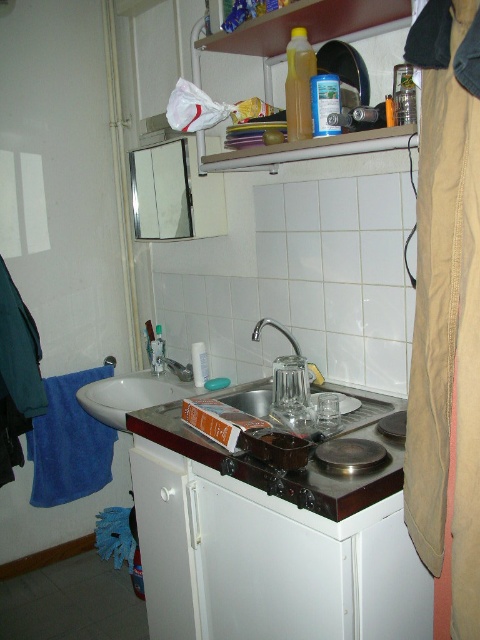
You are trying to place a 12 inch long pan between the black glass stove at center and the silver metallic faucet at center. Will it fit?

The black glass stove at center and silver metallic faucet at center are 13.42 inches apart. Since the pan is 12 inches long, it will fit between them with about 1.42 inches of space remaining.

You are trying to determine which appliance is shorter between the black glass stove at center and the silver metallic faucet at center in the kitchenette. Based on the description, which one is shorter?

The black glass stove at center has a lesser height compared to the silver metallic faucet at center, so the black glass stove at center is shorter.